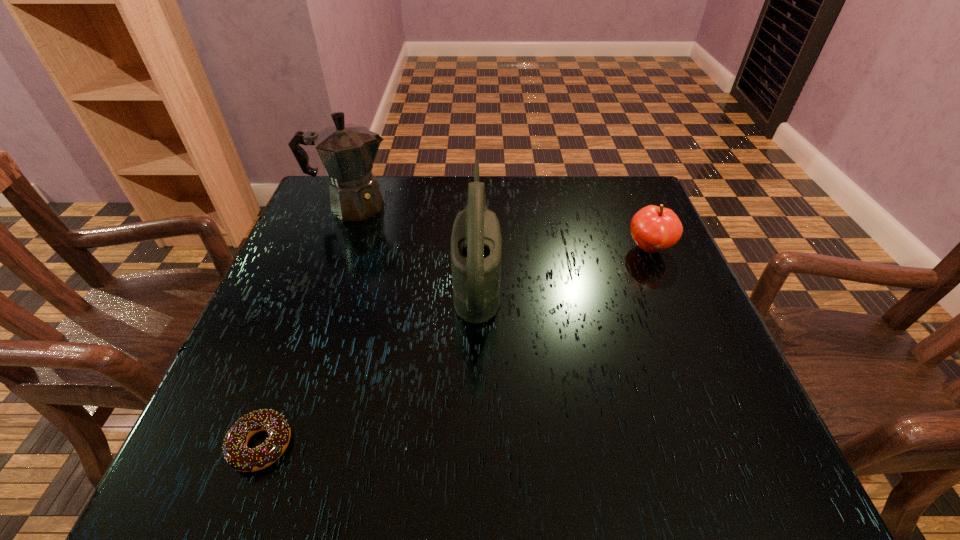
Identify the location of free space between the coffeepot and the third object from left to right. (415, 241).

Find the location of a particular element. The width and height of the screenshot is (960, 540). vacant area that lies between the shortest object and the coffeepot is located at coordinates (306, 326).

The height and width of the screenshot is (540, 960). I want to click on free space between the nearest object and the watering can, so click(369, 361).

Identify the location of free space between the coffeepot and the nearest object. (306, 326).

Locate an element on the screen. object that is the third closest one to the coffeepot is located at coordinates (654, 229).

Find the location of a particular element. Image resolution: width=960 pixels, height=540 pixels. object that ranks as the third closest to the second object from right to left is located at coordinates (654, 229).

This screenshot has height=540, width=960. Find the location of `vacant space that satisfies the following two spatial constraints: 1. on the pouring side of the coffeepot; 2. on the left side of the rightmost object`. vacant space that satisfies the following two spatial constraints: 1. on the pouring side of the coffeepot; 2. on the left side of the rightmost object is located at coordinates (337, 248).

This screenshot has height=540, width=960. Identify the location of free space that satisfies the following two spatial constraints: 1. on the pouring side of the coffeepot; 2. on the left side of the rightmost object. (337, 248).

Identify the location of free region that satisfies the following two spatial constraints: 1. on the pouring side of the coffeepot; 2. on the back side of the rightmost object. (337, 248).

At what (x,y) coordinates should I click in order to perform the action: click on vacant position in the image that satisfies the following two spatial constraints: 1. on the pouring side of the third tallest object; 2. on the left side of the coffeepot. Please return your answer as a coordinate pair (x, y). The height and width of the screenshot is (540, 960). Looking at the image, I should click on (337, 248).